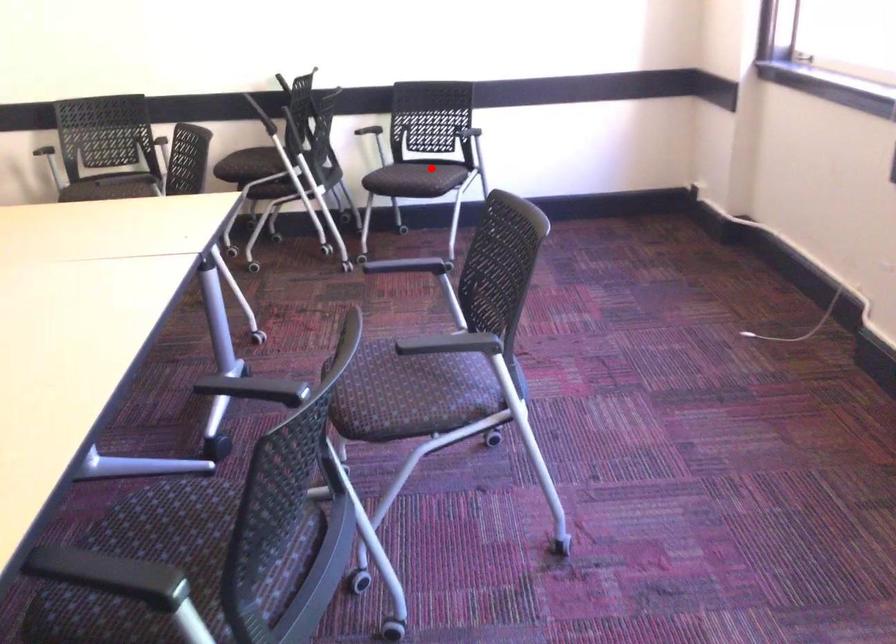
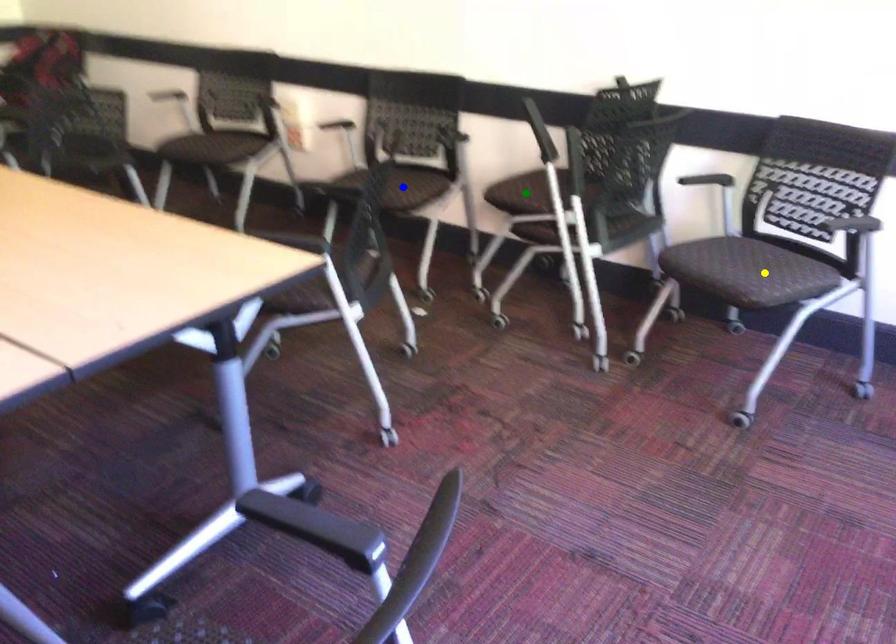
Question: I am providing you with two images of the same scene from different viewpoints. A red point is marked on the first image. You are given multiple points on the second image. Which point in image 2 represents the same 3d spot as the red point in image 1?

Choices:
 (A) yellow point
 (B) blue point
 (C) green point

Answer: (A)